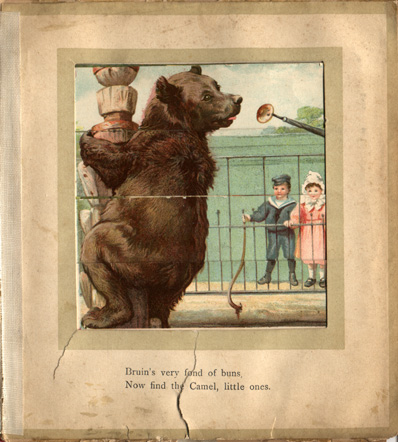
The width and height of the screenshot is (398, 442). In order to click on paper binding from where page was torn out of book in this screenshot , I will do `click(15, 396)`.